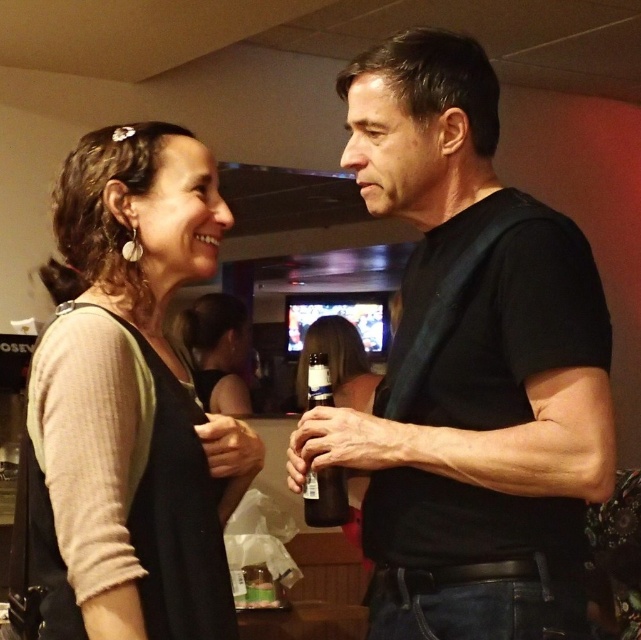
You are a delivery person standing at the entrance of the room. You need to deliver a package to the person with the matte black hair at center. The package can only be placed on the translucent glass bottle at center. Is the distance between them suitable for you to accurately place the package without moving either object?

The distance between the matte black hair at center and the translucent glass bottle at center is 2.05 meters. Since the package needs to be placed on the bottle, this distance may be too far for accurate placement without moving either object.

You are standing in the room and want to locate the matte black hair at center. According to the coordinates given, where exactly is it located?

The matte black hair at center is located at point coordinates of 0.550 on the x axis and 0.340 on the y axis.

You are a photographer taking a picture of the black matte shirt at center and the translucent glass bottle at center. Which object will appear larger in the photo?

The black matte shirt at center will appear larger in the photo because it is closer to the viewer than the translucent glass bottle at center.